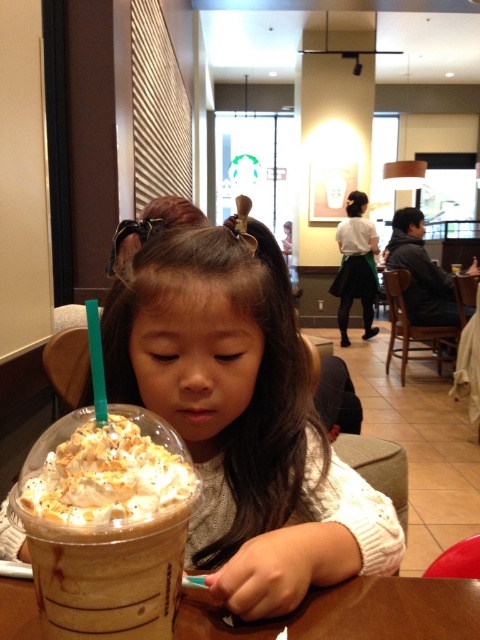
Question: Can you confirm if matte brown cupcake at center is positioned to the left of brown paper cup at center?

Choices:
 (A) yes
 (B) no

Answer: (A)

Question: Which object appears farthest from the camera in this image?

Choices:
 (A) whipped cream topped iced coffee at lower left
 (B) matte brown cupcake at center

Answer: (B)

Question: Can you confirm if whipped cream topped iced coffee at lower left is positioned above brown paper cup at center?

Choices:
 (A) no
 (B) yes

Answer: (B)

Question: Estimate the real-world distances between objects in this image. Which object is farther from the brown paper cup at center?

Choices:
 (A) matte brown cupcake at center
 (B) whipped cream topped iced coffee at lower left

Answer: (A)

Question: Which point appears farthest from the camera in this image?

Choices:
 (A) (273, 573)
 (B) (149, 488)
 (C) (399, 584)

Answer: (C)

Question: Considering the relative positions of whipped cream topped iced coffee at lower left and brown paper cup at center in the image provided, where is whipped cream topped iced coffee at lower left located with respect to brown paper cup at center?

Choices:
 (A) left
 (B) right

Answer: (A)